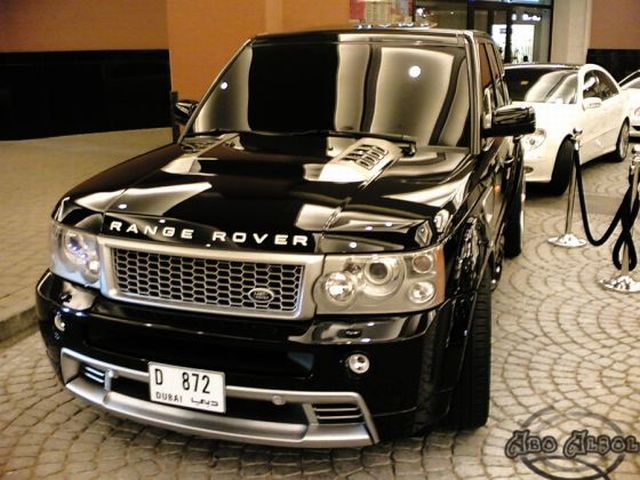
The image size is (640, 480). I want to click on window, so click(x=525, y=29).